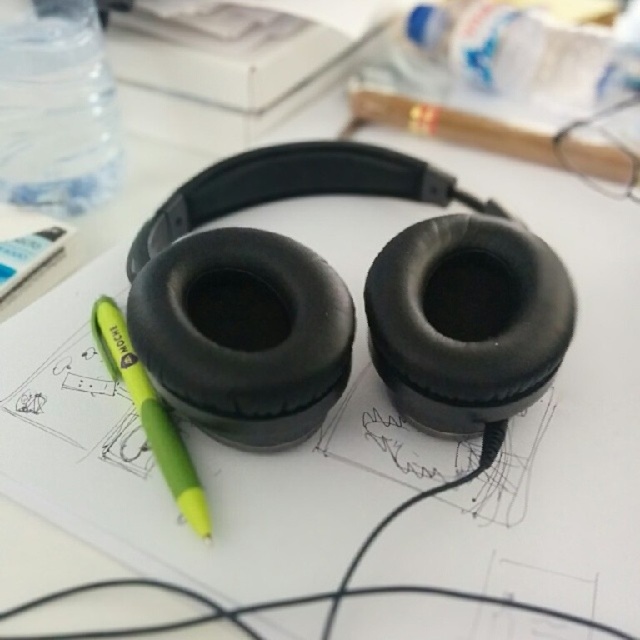
You are an artist working on a project and need to find the green pen. You see the point at coordinates point [56,109]. Is the green pen closer to the point or the black over ear headphones?

The transparent plastic bottle at upper left is located at point [56,109]. The green pen is placed diagonally near the left ear cup, so the green pen is closer to the black over ear headphones than the point.